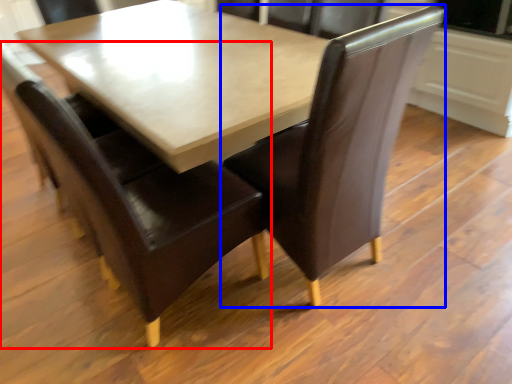
Question: Which of the following is the farthest to the observer, chair (highlighted by a red box) or chair (highlighted by a blue box)?

Choices:
 (A) chair
 (B) chair

Answer: (B)